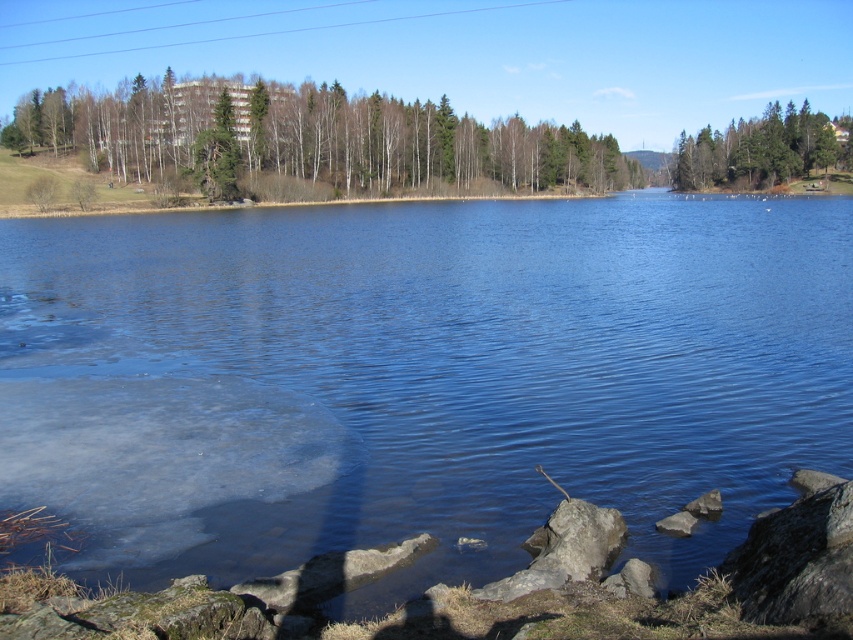
Does gray rock at lower right have a smaller size compared to smooth gray rock at lower right?

Yes, gray rock at lower right is smaller than smooth gray rock at lower right.

Locate an element on the screen. gray rock at lower right is located at coordinates (676, 524).

Consider the image. Measure the distance between gray rock at lower right and camera.

gray rock at lower right and camera are 8.37 meters apart.

The image size is (853, 640). What are the coordinates of `gray rock at lower right` in the screenshot? It's located at (676, 524).

Does point (102, 515) come closer to viewer compared to point (534, 570)?

No, (102, 515) is behind (534, 570).

Does blue water at center have a smaller size compared to rough textured rock at lower right?

No, blue water at center is not smaller than rough textured rock at lower right.

Is point (344, 314) positioned after point (625, 529)?

Yes, it is behind point (625, 529).

Locate an element on the screen. blue water at center is located at coordinates (418, 378).

Is green leafy trees at upper left to the left of smooth gray rock at lower right from the viewer's perspective?

No, green leafy trees at upper left is not to the left of smooth gray rock at lower right.

Does point (635, 163) come farther from viewer compared to point (721, 509)?

Yes, point (635, 163) is farther from viewer.

The height and width of the screenshot is (640, 853). I want to click on green leafy trees at upper left, so click(311, 138).